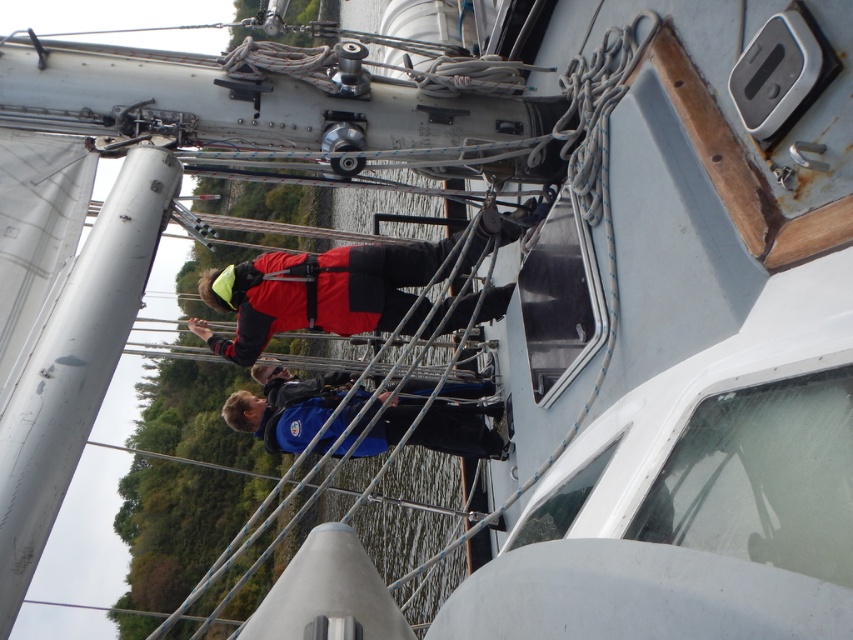
Question: Which point is farther to the camera?

Choices:
 (A) [x=410, y=323]
 (B) [x=328, y=378]

Answer: (B)

Question: Can you confirm if red matte life vest at center is positioned to the left of blue fabric jacket at center?

Choices:
 (A) yes
 (B) no

Answer: (B)

Question: Is red matte life vest at center to the left of blue fabric jacket at center from the viewer's perspective?

Choices:
 (A) yes
 (B) no

Answer: (B)

Question: In this image, where is red matte life vest at center located relative to blue fabric jacket at center?

Choices:
 (A) right
 (B) left

Answer: (A)

Question: Which object appears closest to the camera in this image?

Choices:
 (A) blue fabric jacket at center
 (B) red matte life vest at center

Answer: (A)